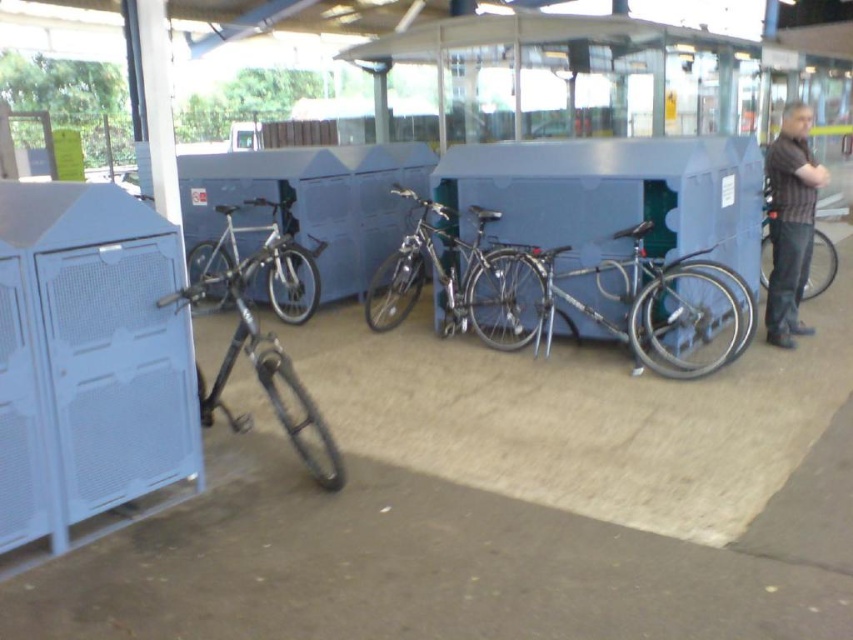
Question: Which object appears closest to the camera in this image?

Choices:
 (A) striped shirt at right
 (B) shiny silver bicycle at center

Answer: (A)

Question: Which of the following is the farthest from the observer?

Choices:
 (A) shiny metallic bicycle at left
 (B) striped shirt at right
 (C) silver metallic bicycle at center
 (D) shiny silver bicycle at center

Answer: (C)

Question: Does shiny metallic bicycle at center appear under shiny metallic bicycle at left?

Choices:
 (A) yes
 (B) no

Answer: (B)

Question: Can you confirm if striped shirt at right is positioned below matte black bicycle at right?

Choices:
 (A) no
 (B) yes

Answer: (A)

Question: Which object appears closest to the camera in this image?

Choices:
 (A) shiny silver bicycle at center
 (B) matte black bicycle at right

Answer: (A)

Question: Can you confirm if shiny metallic bicycle at left is bigger than striped shirt at right?

Choices:
 (A) yes
 (B) no

Answer: (A)